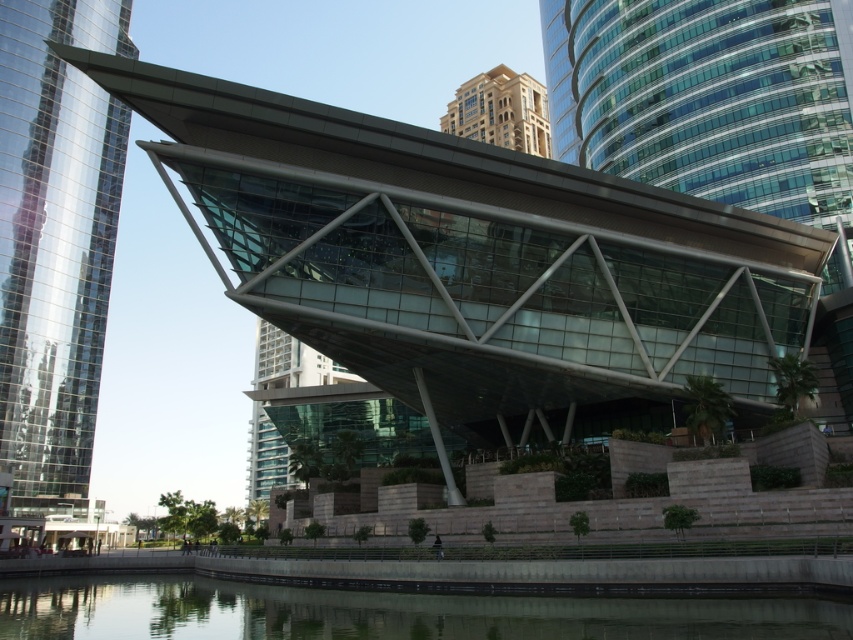
You are standing at the point marked as point (55, 241) in the image. Looking towards the glassy reflective tower at left, which direction should you walk to get closer to it?

Since the point (55, 241) is already at the glassy reflective tower at left, you are already at the tower and do not need to move.

You are standing at the entrance of the modern architectural structure and want to reach the reflective water body in the foreground. According to the image, where is the transparent glass water at lower center located relative to your position?

The transparent glass water at lower center is located at point (381, 612), which means it is positioned to your lower right direction from your current standing point at the entrance.